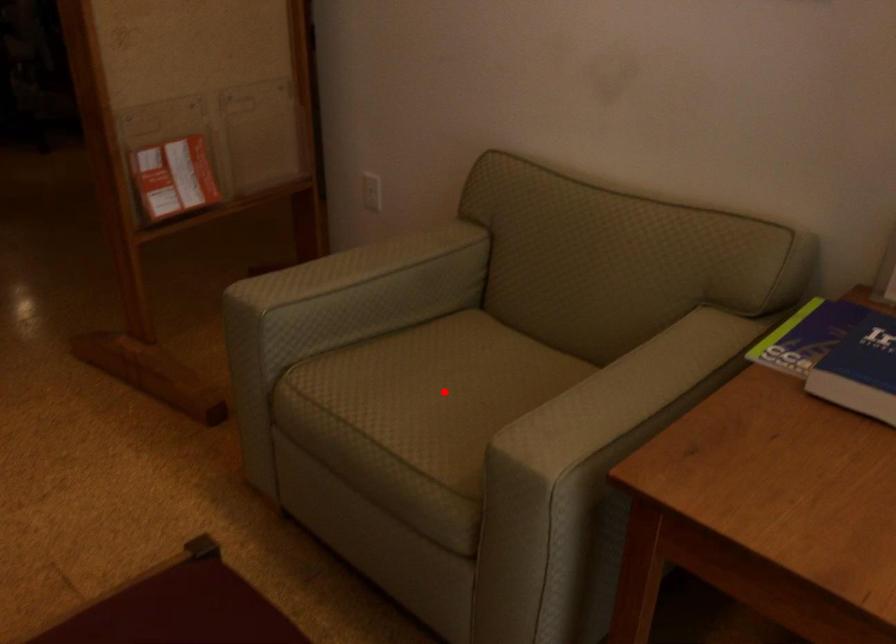
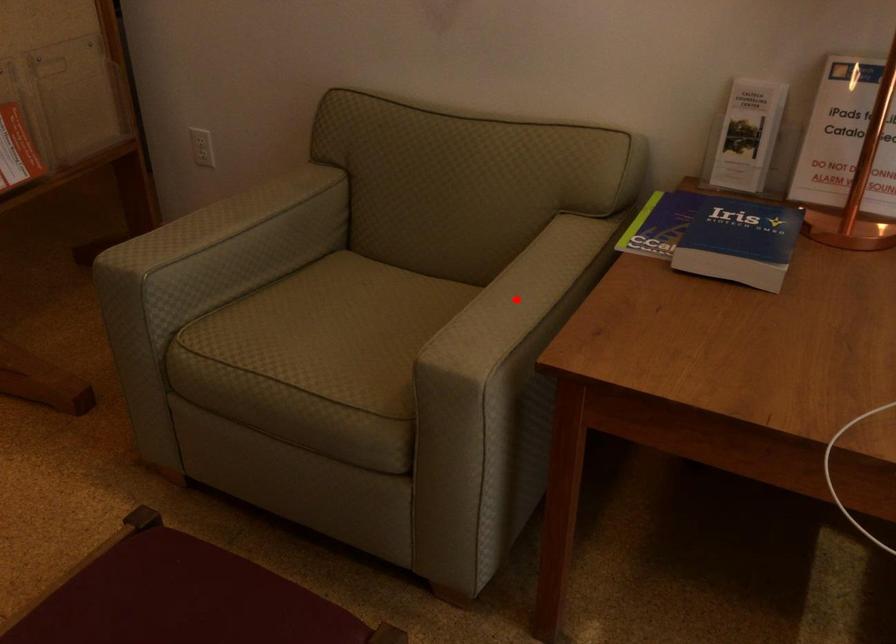
I am providing you with two images of the same scene from different viewpoints. A red point is marked on the first image and another point is marked on the second image. Does the point marked in image1 correspond to the same location as the one in image2?

No